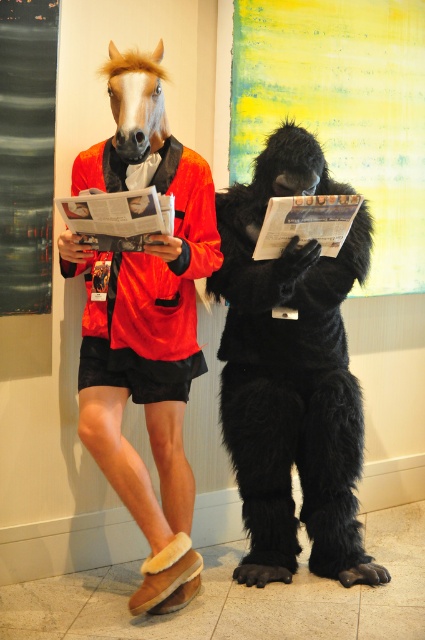
Is matte black costume at left positioned in front of matte black horse mask at center?

Yes, it is.

Which is more to the right, matte black costume at left or matte black horse mask at center?

matte black costume at left

This screenshot has width=425, height=640. What do you see at coordinates (144, 323) in the screenshot? I see `matte black costume at left` at bounding box center [144, 323].

At what (x,y) coordinates should I click in order to perform the action: click on matte black costume at left. Please return your answer as a coordinate pair (x, y). Looking at the image, I should click on (144, 323).

Between point (269, 330) and point (178, 292), which one is positioned behind?

The point (269, 330) is behind.

Which is above, black furry gorilla at center or matte black horse mask at center?

matte black horse mask at center is higher up.

Which is behind, point (316, 182) or point (209, 189)?

Positioned behind is point (209, 189).

I want to click on black furry gorilla at center, so click(291, 374).

Which is below, black furry gorilla at center or matte black costume at left?

black furry gorilla at center is below.

Can you confirm if black furry gorilla at center is positioned to the left of matte black costume at left?

Incorrect, black furry gorilla at center is not on the left side of matte black costume at left.

Is point (297, 316) positioned behind point (102, 292)?

Yes.

Where is `black furry gorilla at center`? Image resolution: width=425 pixels, height=640 pixels. black furry gorilla at center is located at coordinates (291, 374).